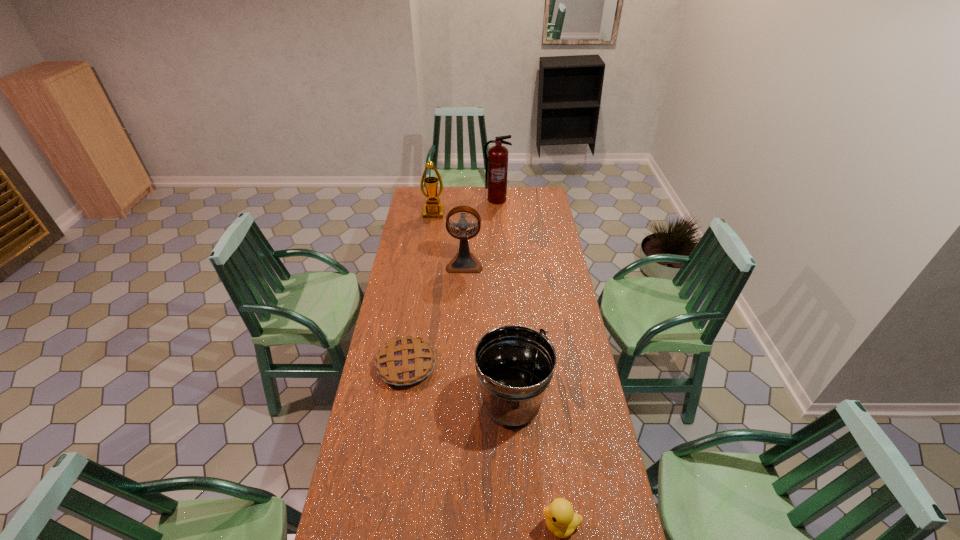
Locate an element on the screen. The height and width of the screenshot is (540, 960). free space located on the right of the shortest object is located at coordinates (501, 365).

Where is `object that is at the far edge`? The height and width of the screenshot is (540, 960). object that is at the far edge is located at coordinates (496, 165).

Find the location of `award present at the left edge`. award present at the left edge is located at coordinates (433, 209).

Where is `pie present at the left edge`? Image resolution: width=960 pixels, height=540 pixels. pie present at the left edge is located at coordinates (405, 361).

Where is `vacant space at the left edge of the desktop`? vacant space at the left edge of the desktop is located at coordinates (424, 259).

Locate an element on the screen. blank space at the right edge is located at coordinates (557, 269).

At what (x,y) coordinates should I click in order to perform the action: click on free space at the far right corner of the desktop. Please return your answer as a coordinate pair (x, y). Looking at the image, I should click on (538, 194).

Find the location of a particular element. This screenshot has height=540, width=960. free space between the bucket and the fifth nearest object is located at coordinates (472, 309).

Identify the location of vacant area that lies between the bucket and the pie. (459, 384).

You are a GUI agent. You are given a task and a screenshot of the screen. Output one action in this format:
    pyautogui.click(x=<x>, y=<y>)
    Task: Click on the free spot between the award and the bucket
    
    Given the screenshot: What is the action you would take?
    pyautogui.click(x=472, y=309)